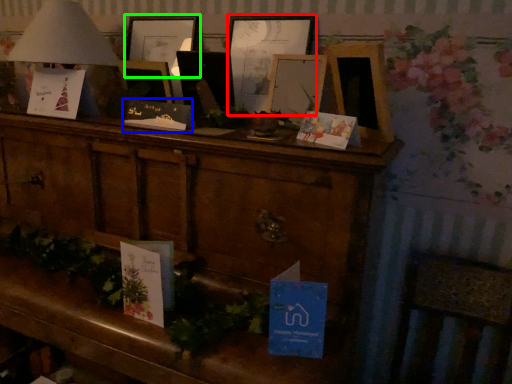
Question: Estimate the real-world distances between objects in this image. Which object is closer to picture frame (highlighted by a red box), christmas card (highlighted by a blue box) or picture frame (highlighted by a green box)?

Choices:
 (A) christmas card
 (B) picture frame

Answer: (B)